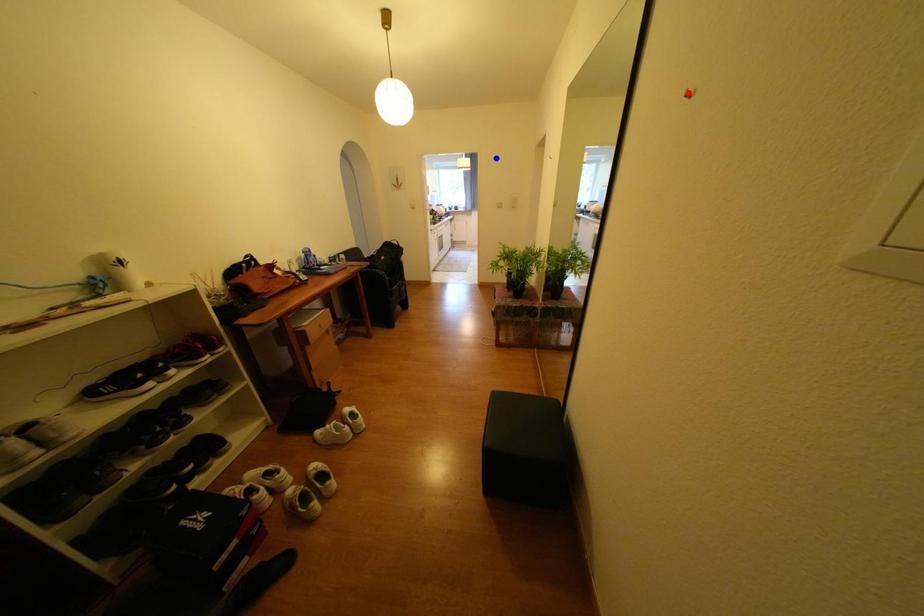
Question: In the image, two points are highlighted. Which point is nearer to the camera? Reply with the corresponding letter.

Choices:
 (A) blue point
 (B) red point

Answer: (B)